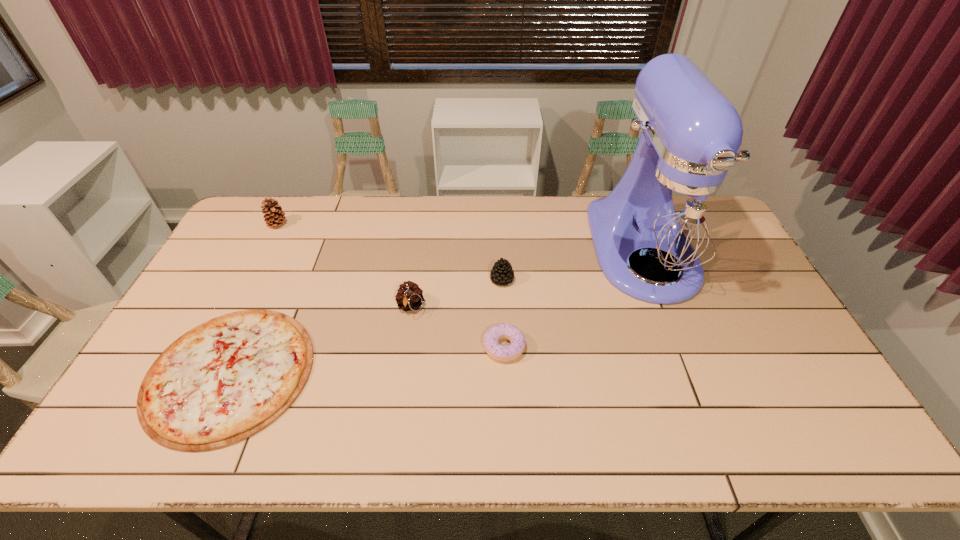
Where is `blank region between the second nearest pinecone and the doughnut`? blank region between the second nearest pinecone and the doughnut is located at coordinates (503, 313).

Find the location of `object that stands as the third closest to the fifth tallest object`. object that stands as the third closest to the fifth tallest object is located at coordinates (674, 213).

Locate an element on the screen. This screenshot has width=960, height=540. object that is the second closest to the shortest object is located at coordinates click(274, 215).

This screenshot has width=960, height=540. Find the location of `pinecone that is the third closest to the pizza`. pinecone that is the third closest to the pizza is located at coordinates (502, 273).

Where is `the closest pinecone relative to the shortest object`? The width and height of the screenshot is (960, 540). the closest pinecone relative to the shortest object is located at coordinates (410, 297).

You are a GUI agent. You are given a task and a screenshot of the screen. Output one action in this format:
    pyautogui.click(x=<x>, y=<y>)
    Task: Click on the vacant region that satisfies the following two spatial constraints: 1. on the back side of the pizza; 2. on the right side of the fifth tallest object
    
    Given the screenshot: What is the action you would take?
    pyautogui.click(x=242, y=347)

Identify the location of vacant area that satisfies the following two spatial constraints: 1. at the mixing area of the rightmost object; 2. at the narrow end of the rightmost pinecone. (655, 279).

Identify the location of free space in the image that satisfies the following two spatial constraints: 1. with a leaf charm attached to the nearest pinecone; 2. on the left side of the second shortest object. The image size is (960, 540). (404, 347).

Locate an element on the screen. The image size is (960, 540). free point that satisfies the following two spatial constraints: 1. at the narrow end of the rightmost pinecone; 2. on the front side of the pizza is located at coordinates (507, 373).